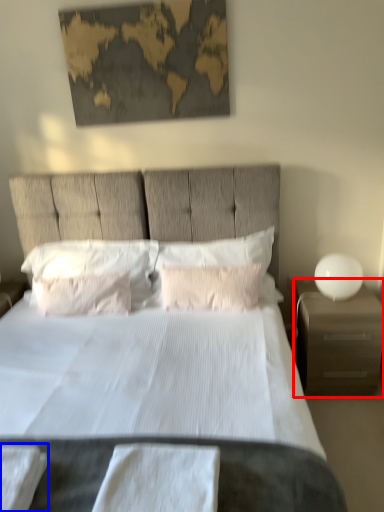
Question: Which point is further to the camera, nightstand (highlighted by a red box) or sheet (highlighted by a blue box)?

Choices:
 (A) nightstand
 (B) sheet

Answer: (A)